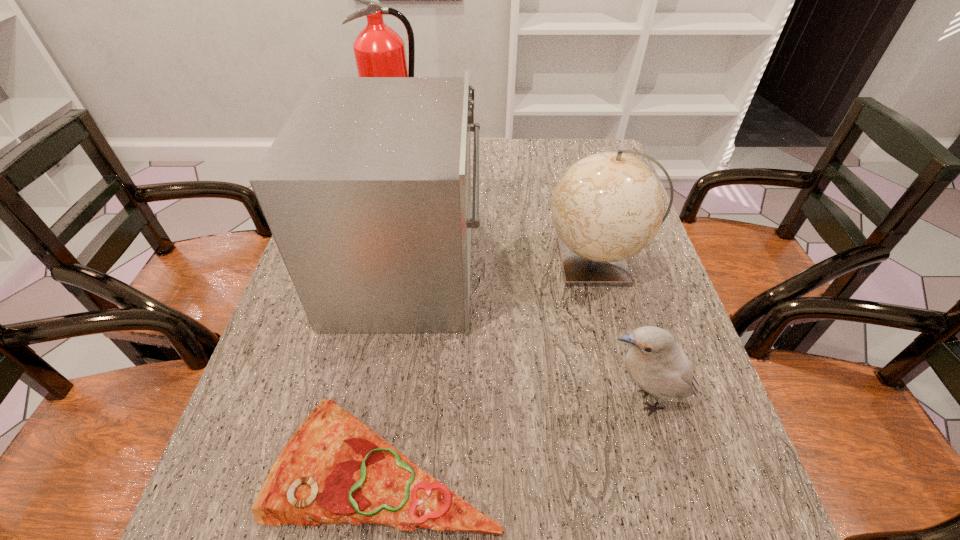
Where is `free location that satisfies the following two spatial constraints: 1. at the nozzle of the fire extinguisher; 2. on the left side of the pizza`? Image resolution: width=960 pixels, height=540 pixels. free location that satisfies the following two spatial constraints: 1. at the nozzle of the fire extinguisher; 2. on the left side of the pizza is located at coordinates (322, 463).

At what (x,y) coordinates should I click in order to perform the action: click on vacant region that satisfies the following two spatial constraints: 1. at the nozzle of the shortest object; 2. on the left side of the fire extinguisher. Please return your answer as a coordinate pair (x, y). Looking at the image, I should click on (322, 463).

Where is `vacant point that satisfies the following two spatial constraints: 1. on the front panel of the toaster oven; 2. on the left side of the shortest object`? Image resolution: width=960 pixels, height=540 pixels. vacant point that satisfies the following two spatial constraints: 1. on the front panel of the toaster oven; 2. on the left side of the shortest object is located at coordinates (376, 463).

Locate an element on the screen. The image size is (960, 540). free region that satisfies the following two spatial constraints: 1. at the nozzle of the shortest object; 2. on the left side of the fire extinguisher is located at coordinates (322, 463).